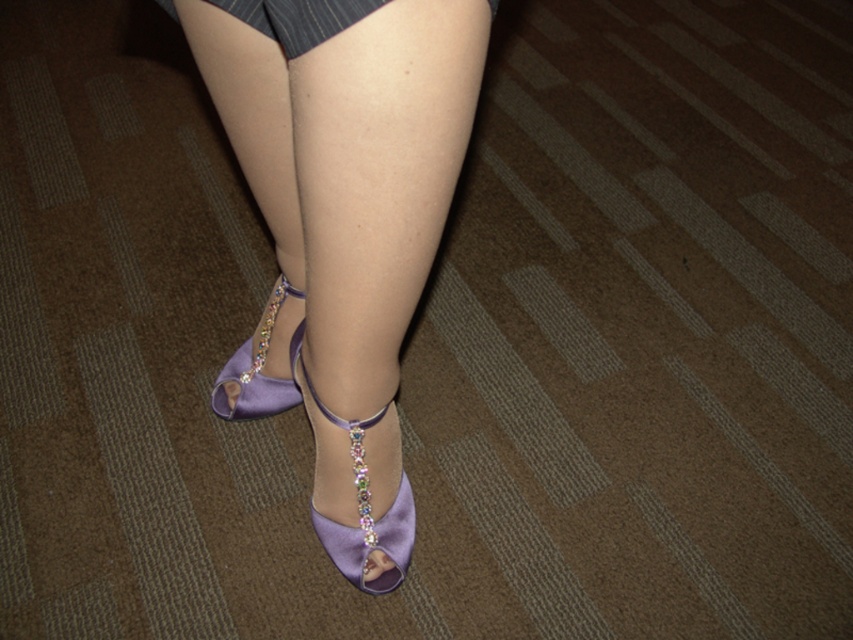
In the scene shown: You are a photographer setting up a shoot. You have two points marked in the image for focus adjustments. The first point is at point [358,461] and the second point is at point [281,26]. If you want to focus on the point that is closer to the camera, which point should you choose?

Point [281,26] is closer to the camera than point [358,461], so you should choose point [281,26] for focusing.